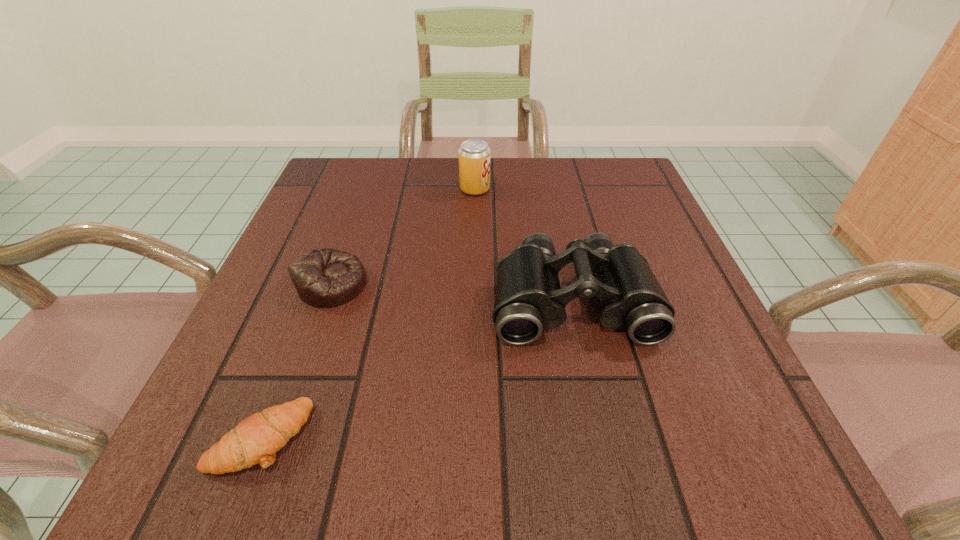
Identify the location of vacant space at the near right corner of the desktop. Image resolution: width=960 pixels, height=540 pixels. (757, 443).

The image size is (960, 540). I want to click on free area in between the binoculars and the third tallest object, so click(x=452, y=292).

In order to click on free spot between the nearest object and the farthest object in this screenshot , I will do `click(368, 313)`.

Locate an element on the screen. free space between the nearest object and the pop (soda) is located at coordinates (368, 313).

Image resolution: width=960 pixels, height=540 pixels. What are the coordinates of `blank region between the binoculars and the nearest object` in the screenshot? It's located at (417, 368).

At what (x,y) coordinates should I click in order to perform the action: click on free space between the binoculars and the shortest object. Please return your answer as a coordinate pair (x, y). This screenshot has width=960, height=540. Looking at the image, I should click on (417, 368).

The height and width of the screenshot is (540, 960). I want to click on free space between the pop (soda) and the beanbag, so click(x=403, y=237).

I want to click on vacant region between the pop (soda) and the nearest object, so click(x=368, y=313).

The height and width of the screenshot is (540, 960). I want to click on vacant space in between the binoculars and the crescent roll, so click(x=417, y=368).

At what (x,y) coordinates should I click in order to perform the action: click on object that stands as the second closest to the binoculars. Please return your answer as a coordinate pair (x, y). The width and height of the screenshot is (960, 540). Looking at the image, I should click on (324, 278).